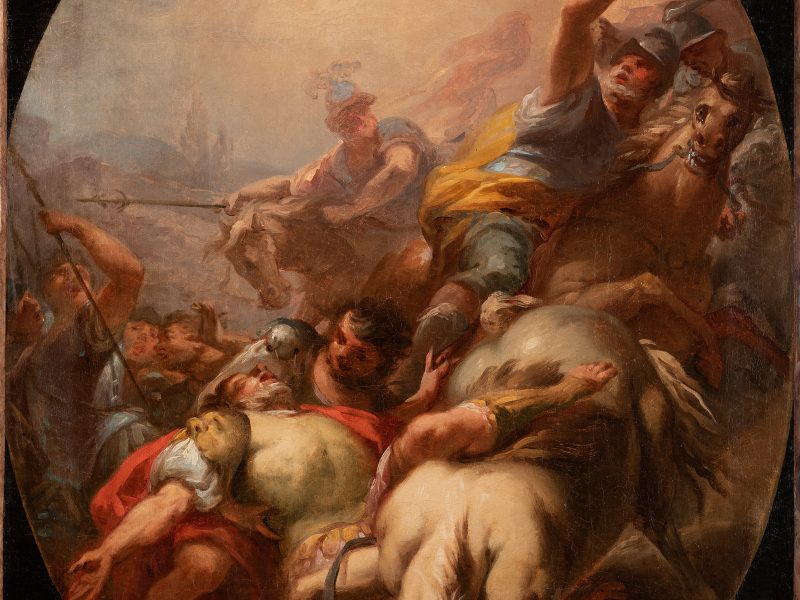
The image size is (800, 600). What are the coordinates of `painting` in the screenshot? It's located at (216, 162).